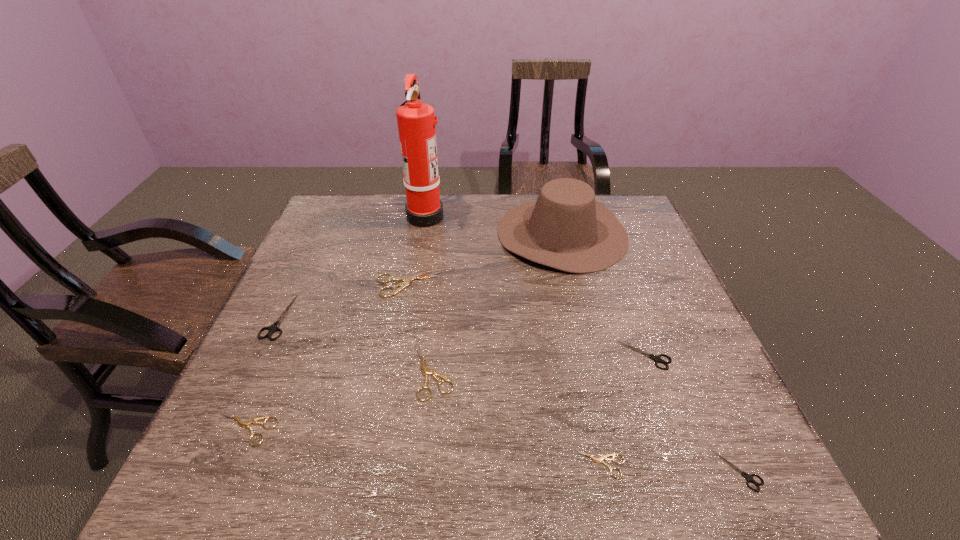
The image size is (960, 540). What are the coordinates of `fire extinguisher` in the screenshot? It's located at (416, 122).

Image resolution: width=960 pixels, height=540 pixels. Identify the location of red fire extinguisher. (416, 122).

At what (x,y) coordinates should I click in order to perform the action: click on cowboy hat. Please return your answer as a coordinate pair (x, y). Looking at the image, I should click on (565, 228).

Image resolution: width=960 pixels, height=540 pixels. I want to click on the eighth shortest object, so click(565, 228).

What are the coordinates of `the biggest black shears` in the screenshot? It's located at (274, 327).

Where is `the biggest beige shears`? The width and height of the screenshot is (960, 540). the biggest beige shears is located at coordinates 407,280.

You are a GUI agent. You are given a task and a screenshot of the screen. Output one action in this format:
    pyautogui.click(x=<x>, y=<y>)
    Task: Click on the second black shears from left to right
    This screenshot has width=960, height=540.
    Given the screenshot: What is the action you would take?
    pyautogui.click(x=657, y=358)

Image resolution: width=960 pixels, height=540 pixels. Find the location of `the second biggest black shears`. the second biggest black shears is located at coordinates (657, 358).

Identify the location of the third nearest beige shears. (426, 372).

Locate an element on the screen. the third farthest beige shears is located at coordinates 244,424.